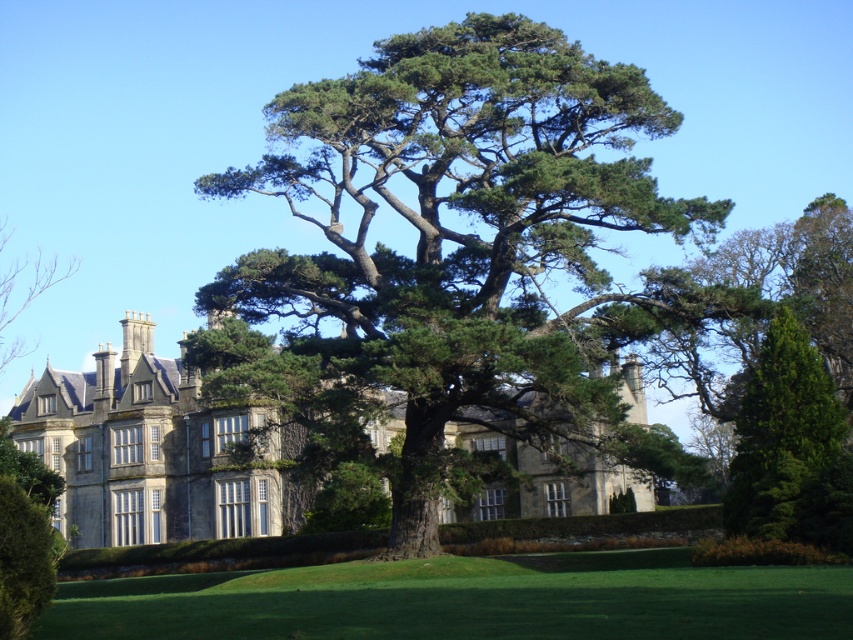
You are standing on the lawn and want to walk towards the stone mansion at center and the green leafy hedge at lower right. Which object will you reach first?

You will reach the green leafy hedge at lower right first because it is closer to you than the stone mansion at center, which is further away.

You are standing in front of the grand stone building and want to determine the relative positions of two points marked on the facade. Which of the two points, point (407,634) or point (468,449), is closer to you?

Point (407,634) is closer to the viewer than point (468,449).

You are standing in front of the grand stone building and notice two trees in the image. Which tree, the green textured tree at center or the green leafy tree at upper left, is closer to you?

The green textured tree at center is closer to you because it is positioned in front of the green leafy tree at upper left.